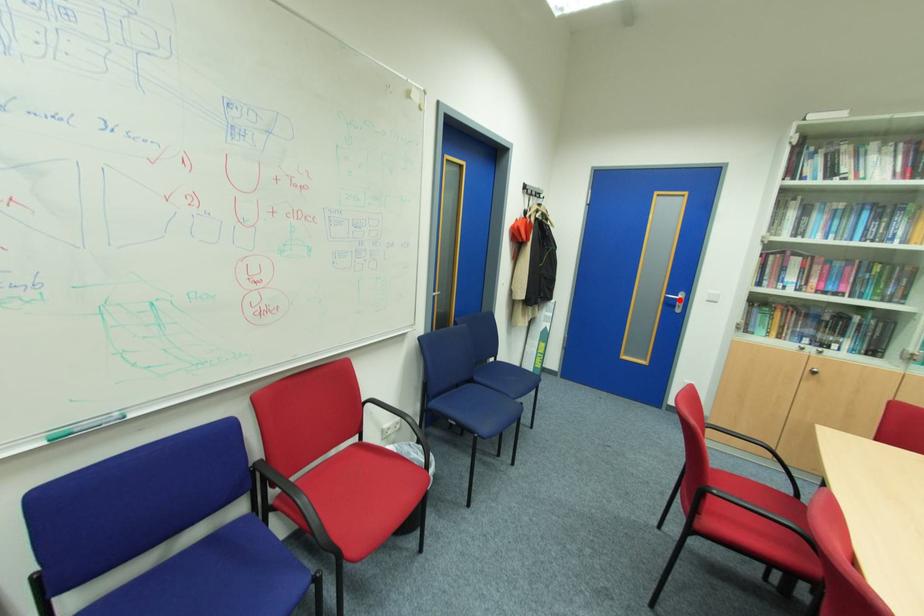
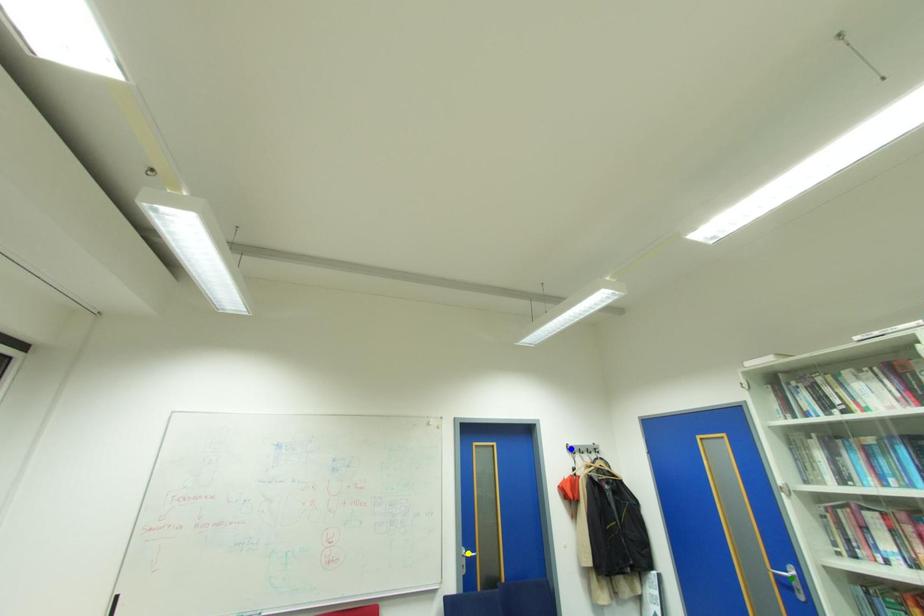
Question: I am providing you with two images of the same scene from different viewpoints. A red point is marked on the first image. You are given multiple points on the second image. In image 2, which mark is for the same physical point as the one in image 1?

Choices:
 (A) green point
 (B) yellow point
 (C) blue point

Answer: (A)